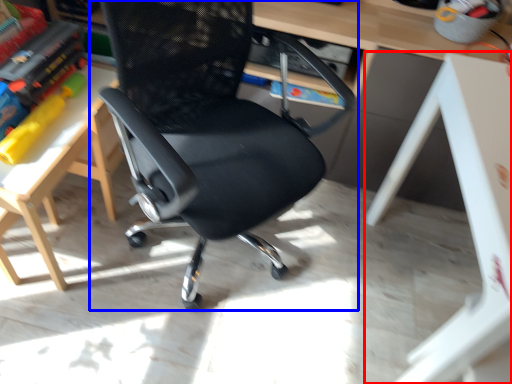
Question: Which point is closer to the camera, table (highlighted by a red box) or chair (highlighted by a blue box)?

Choices:
 (A) table
 (B) chair

Answer: (B)